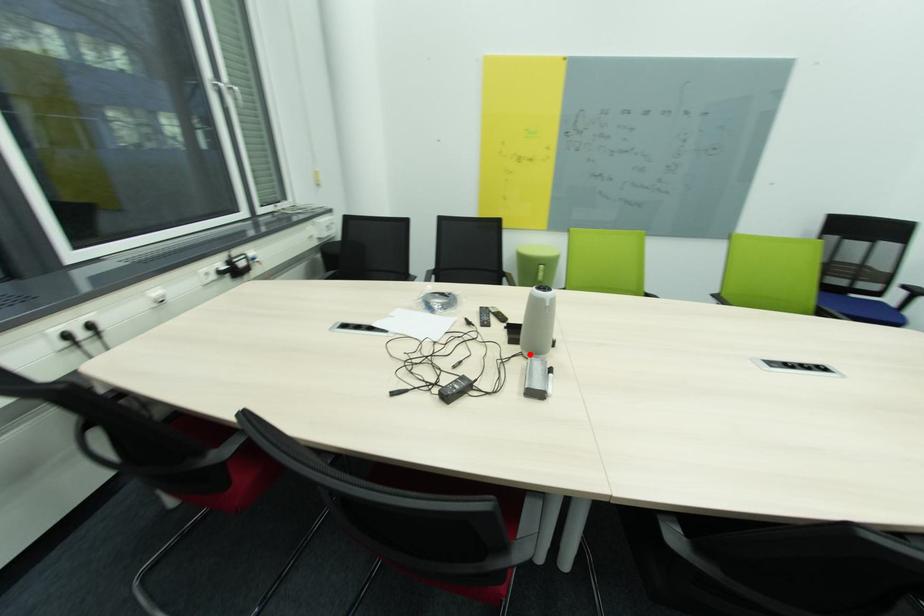
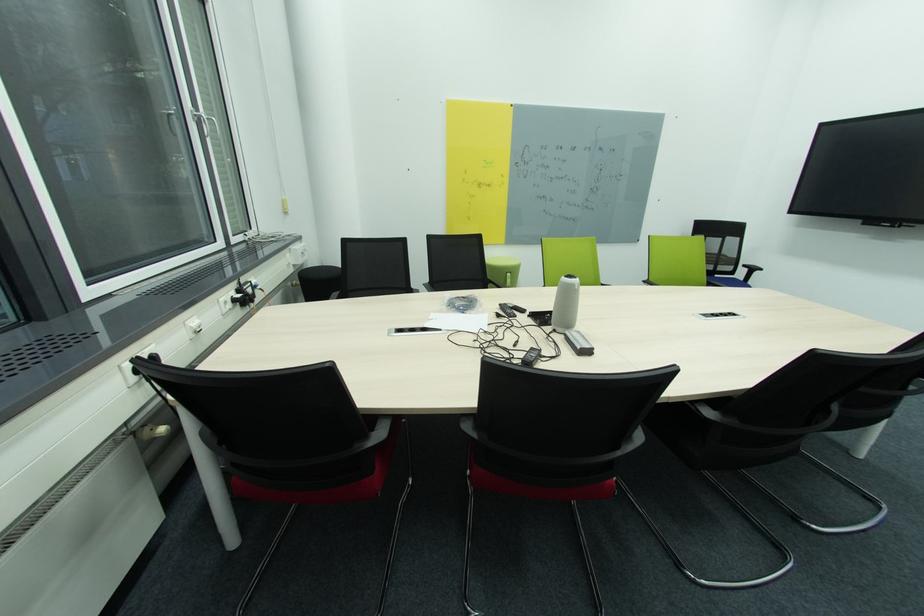
The point at the highlighted location is marked in the first image. Where is the corresponding point in the second image?

(563, 331)